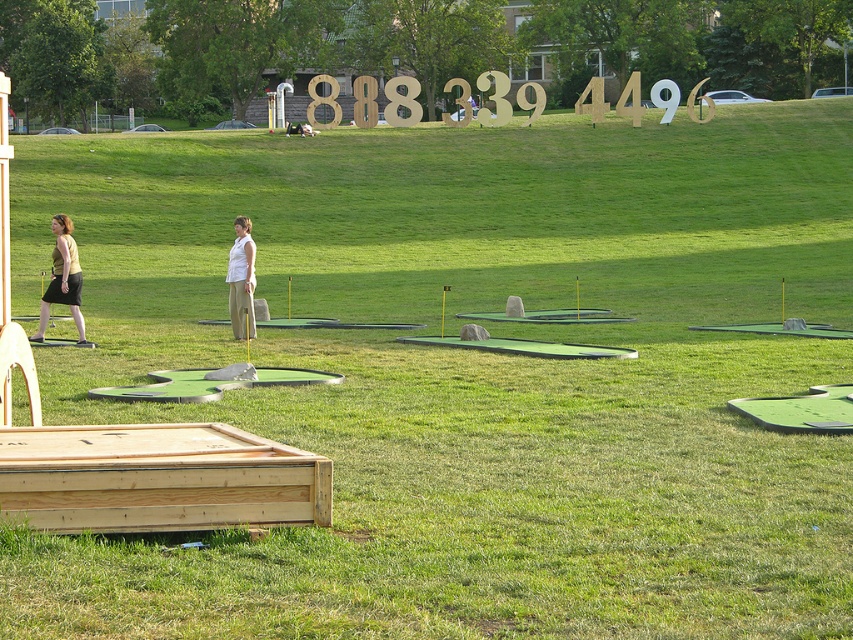
Question: Is matte yellow shirt at left below white cotton shirt at center?

Choices:
 (A) no
 (B) yes

Answer: (B)

Question: Which point is farther to the camera?

Choices:
 (A) matte yellow shirt at left
 (B) white cotton shirt at center

Answer: (B)

Question: Can you confirm if matte yellow shirt at left is thinner than white cotton shirt at center?

Choices:
 (A) yes
 (B) no

Answer: (B)

Question: Does matte yellow shirt at left appear on the left side of white cotton shirt at center?

Choices:
 (A) yes
 (B) no

Answer: (A)